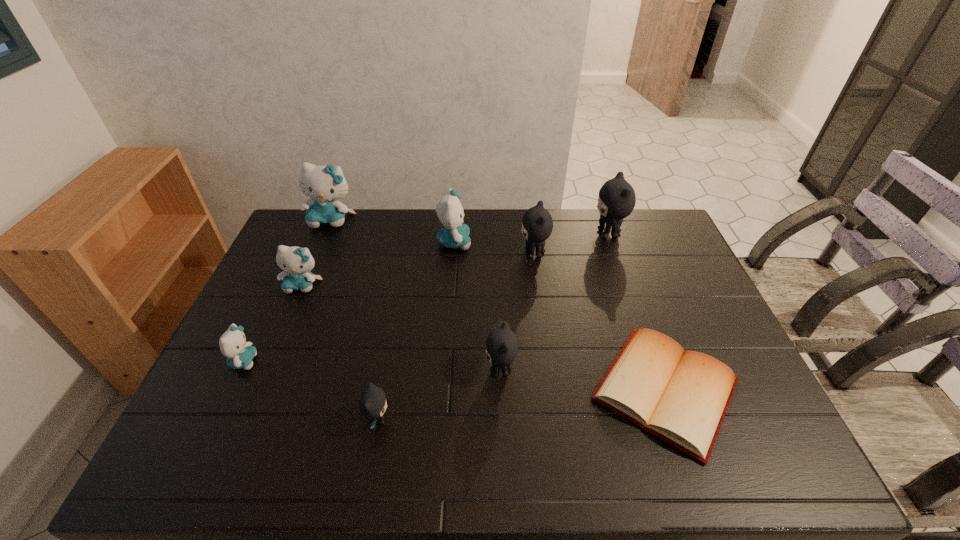
What are the coordinates of `free spot between the second kitten from right to left and the fifth object from left to right` in the screenshot? It's located at (494, 248).

Identify the location of vacant region between the fifth object from right to left and the biggest blue kitten. The width and height of the screenshot is (960, 540). point(393,231).

At what (x,y) coordinates should I click in order to perform the action: click on vacant area between the third biggest gray kitten and the third smallest gray kitten. Please return your answer as a coordinate pair (x, y). Image resolution: width=960 pixels, height=540 pixels. Looking at the image, I should click on (517, 312).

This screenshot has width=960, height=540. I want to click on free space between the fifth kitten from left to right and the sixth kitten from left to right, so click(x=477, y=306).

Where is `free space between the fourth object from left to right and the sixth object from left to right`? free space between the fourth object from left to right and the sixth object from left to right is located at coordinates (440, 395).

Image resolution: width=960 pixels, height=540 pixels. Identify the location of unoccupied area between the fifth farthest kitten and the second kitten from right to left. (419, 269).

Locate an element on the screen. free space that is in between the biggest blue kitten and the red Bible is located at coordinates click(x=498, y=305).

This screenshot has width=960, height=540. In order to click on empty space that is in between the smallest blue kitten and the nearest gray kitten in this screenshot , I will do `click(311, 390)`.

Find the location of a particular element. Image resolution: width=960 pixels, height=540 pixels. vacant area between the fourth kitten from right to left and the smallest blue kitten is located at coordinates (349, 302).

Image resolution: width=960 pixels, height=540 pixels. I want to click on free spot between the Bible and the rightmost gray kitten, so click(636, 312).